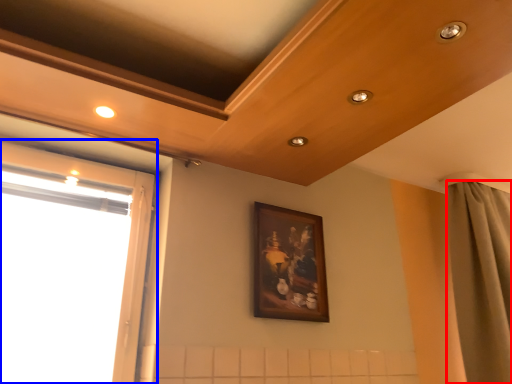
Question: Which object is closer to the camera taking this photo, curtain (highlighted by a red box) or window (highlighted by a blue box)?

Choices:
 (A) curtain
 (B) window

Answer: (B)